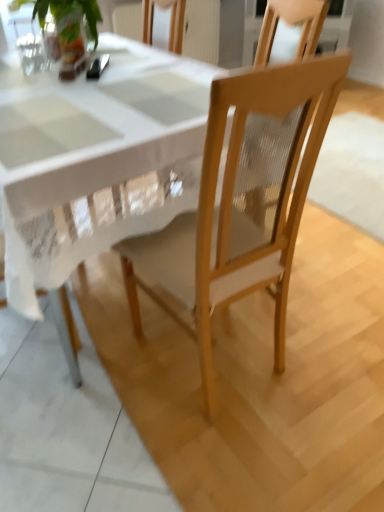
Question: Is green leafy plant at upper left in front of or behind light wood chair at center in the image?

Choices:
 (A) front
 (B) behind

Answer: (B)

Question: Considering the positions of green leafy plant at upper left and light wood chair at center in the image, is green leafy plant at upper left bigger or smaller than light wood chair at center?

Choices:
 (A) big
 (B) small

Answer: (B)

Question: Which of these objects is positioned farthest from the green leafy plant at upper left?

Choices:
 (A) white glossy table at center
 (B) light wood chair at center
 (C) metallic silver spoon at upper left

Answer: (B)

Question: Based on their relative distances, which object is farther from the metallic silver spoon at upper left?

Choices:
 (A) green leafy plant at upper left
 (B) light wood chair at center
 (C) white glossy table at center

Answer: (B)